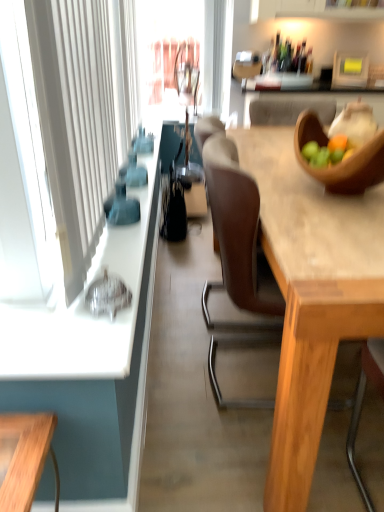
The height and width of the screenshot is (512, 384). Find the location of `black leather handbag at center`. black leather handbag at center is located at coordinates (175, 214).

Based on the photo, considering the sizes of white fabric curtain at left and wooden bowl at upper right in the image, is white fabric curtain at left bigger or smaller than wooden bowl at upper right?

Considering their sizes, white fabric curtain at left takes up more space than wooden bowl at upper right.

Is white fabric curtain at left behind wooden bowl at upper right?

That is False.

Who is taller, white fabric curtain at left or wooden bowl at upper right?

Standing taller between the two is white fabric curtain at left.

From a real-world perspective, is white fabric curtain at left physically located above or below wooden bowl at upper right?

Clearly, from a real-world perspective, white fabric curtain at left is above wooden bowl at upper right.

Would you say white fabric curtain at left is a long distance from wooden table at center?

Actually, white fabric curtain at left and wooden table at center are a little close together.

The width and height of the screenshot is (384, 512). Identify the location of desk located on the right of white fabric curtain at left. (311, 296).

Is wooden table at center located within white fabric curtain at left?

No, white fabric curtain at left does not contain wooden table at center.

From a real-world perspective, is white fabric curtain at left physically located above or below wooden table at center?

Clearly, from a real-world perspective, white fabric curtain at left is above wooden table at center.

From the image's perspective, which one is positioned lower, wooden bowl at upper right or wooden table at center?

wooden table at center.

From a real-world perspective, relative to wooden table at center, is wooden bowl at upper right vertically above or below?

wooden bowl at upper right is situated higher than wooden table at center in the real world.

Is wooden bowl at upper right further to camera compared to wooden table at center?

Yes, it is.

Which is less distant, (335, 181) or (269, 475)?

Clearly, point (335, 181) is more distant from the camera than point (269, 475).

Are black leather handbag at center and wooden bowl at upper right making contact?

No, black leather handbag at center is not touching wooden bowl at upper right.

Considering the sizes of objects black leather handbag at center and wooden bowl at upper right in the image provided, who is thinner, black leather handbag at center or wooden bowl at upper right?

Thinner between the two is black leather handbag at center.

Is black leather handbag at center spatially inside wooden bowl at upper right, or outside of it?

black leather handbag at center is located beyond the bounds of wooden bowl at upper right.

From a real-world perspective, relative to wooden bowl at upper right, is black leather handbag at center vertically above or below?

black leather handbag at center is situated lower than wooden bowl at upper right in the real world.

Measure the distance between wooden table at center and wooden bowl at upper right.

wooden table at center is 25.51 centimeters from wooden bowl at upper right.

In the scene shown: Considering the sizes of objects wooden table at center and wooden bowl at upper right in the image provided, who is smaller, wooden table at center or wooden bowl at upper right?

wooden bowl at upper right is smaller.

Can you tell me how much wooden table at center and wooden bowl at upper right differ in facing direction?

The angle between the facing direction of wooden table at center and the facing direction of wooden bowl at upper right is 0.248 degrees.

Is wooden table at center in contact with wooden bowl at upper right?

No, wooden table at center is not making contact with wooden bowl at upper right.

Visually, is wooden bowl at upper right positioned to the left or to the right of white fabric curtain at left?

Based on their positions, wooden bowl at upper right is located to the right of white fabric curtain at left.

Which object is thinner, wooden bowl at upper right or white fabric curtain at left?

white fabric curtain at left is thinner.

From the image's perspective, is wooden bowl at upper right on top of white fabric curtain at left?

No.

Considering the relative sizes of wooden bowl at upper right and black leather handbag at center in the image provided, is wooden bowl at upper right bigger than black leather handbag at center?

Indeed, wooden bowl at upper right has a larger size compared to black leather handbag at center.

From a real-world perspective, does wooden bowl at upper right sit lower than black leather handbag at center?

No, from a real-world perspective, wooden bowl at upper right is not below black leather handbag at center.

Can we say wooden bowl at upper right lies outside black leather handbag at center?

Indeed, wooden bowl at upper right is completely outside black leather handbag at center.

How different are the orientations of wooden bowl at upper right and black leather handbag at center in degrees?

The angular difference between wooden bowl at upper right and black leather handbag at center is 2.49 degrees.

You are a GUI agent. You are given a task and a screenshot of the screen. Output one action in this format:
    pyautogui.click(x=<x>, y=<y>)
    Task: Click on the curtain located on the left of wooden bowl at upper right
    The image size is (384, 512).
    Given the screenshot: What is the action you would take?
    click(x=81, y=114)

The width and height of the screenshot is (384, 512). I want to click on desk on the right side of white fabric curtain at left, so click(311, 296).

Estimate the real-world distances between objects in this image. Which object is further from wooden bowl at upper right, black leather handbag at center or white fabric curtain at left?

black leather handbag at center lies further to wooden bowl at upper right than the other object.

Estimate the real-world distances between objects in this image. Which object is closer to white fabric curtain at left, wooden table at center or black leather handbag at center?

wooden table at center is closer to white fabric curtain at left.

When comparing their distances from wooden bowl at upper right, does white fabric curtain at left or wooden table at center seem closer?

wooden table at center lies closer to wooden bowl at upper right than the other object.

When comparing their distances from wooden table at center, does black leather handbag at center or wooden bowl at upper right seem further?

The object further to wooden table at center is black leather handbag at center.

Looking at the image, which one is located closer to black leather handbag at center, wooden table at center or wooden bowl at upper right?

Among the two, wooden table at center is located nearer to black leather handbag at center.

Based on the photo, which object lies nearer to the anchor point wooden table at center, wooden bowl at upper right or white fabric curtain at left?

Among the two, wooden bowl at upper right is located nearer to wooden table at center.

Looking at the image, which one is located further to black leather handbag at center, white fabric curtain at left or wooden table at center?

wooden table at center.

Estimate the real-world distances between objects in this image. Which object is further from wooden table at center, black leather handbag at center or white fabric curtain at left?

black leather handbag at center lies further to wooden table at center than the other object.

This screenshot has height=512, width=384. I want to click on bowl between wooden table at center and black leather handbag at center in the front-back direction, so coord(341,164).

Identify the location of bowl between white fabric curtain at left and wooden table at center. Image resolution: width=384 pixels, height=512 pixels. (341, 164).

Where is `bowl positioned between white fabric curtain at left and black leather handbag at center from near to far`? The height and width of the screenshot is (512, 384). bowl positioned between white fabric curtain at left and black leather handbag at center from near to far is located at coordinates (341, 164).

Image resolution: width=384 pixels, height=512 pixels. I want to click on desk between white fabric curtain at left and black leather handbag at center along the z-axis, so click(x=311, y=296).